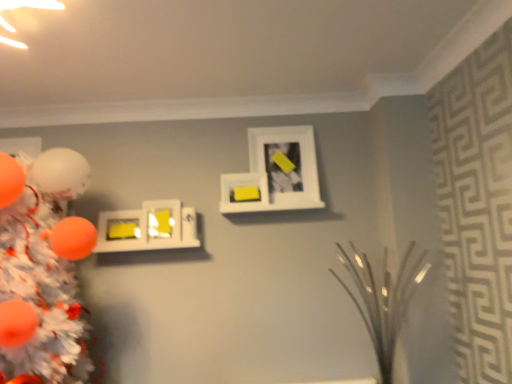
This screenshot has height=384, width=512. What do you see at coordinates (275, 173) in the screenshot?
I see `white matte picture frame at upper center, which appears as the 4th picture frame when viewed from the left` at bounding box center [275, 173].

The width and height of the screenshot is (512, 384). Find the location of `yellow matte picture frame at upper center, the 3th picture frame positioned from the left`. yellow matte picture frame at upper center, the 3th picture frame positioned from the left is located at coordinates (234, 187).

Measure the distance between yellow matte picture frame at center left, placed as the first picture frame when sorted from left to right, and camera.

yellow matte picture frame at center left, placed as the first picture frame when sorted from left to right, and camera are 7.23 feet apart.

Describe the element at coordinates (383, 299) in the screenshot. The width and height of the screenshot is (512, 384). I see `clear glass vase at center right` at that location.

The height and width of the screenshot is (384, 512). I want to click on white matte picture frame at upper center, which appears as the 4th picture frame when viewed from the left, so click(275, 173).

Can you confirm if orange matte christmas tree at left is positioned to the left of yellow matte picture frame at upper center, arranged as the second picture frame when viewed from the right?

Yes.

How different are the orientations of orange matte christmas tree at left and yellow matte picture frame at upper center, the 3th picture frame positioned from the left, in degrees?

The facing directions of orange matte christmas tree at left and yellow matte picture frame at upper center, the 3th picture frame positioned from the left, are 2.42 degrees apart.

Looking at their sizes, would you say orange matte christmas tree at left is wider or thinner than yellow matte picture frame at upper center, arranged as the second picture frame when viewed from the right?

Considering their sizes, orange matte christmas tree at left looks broader than yellow matte picture frame at upper center, arranged as the second picture frame when viewed from the right.

Is orange matte christmas tree at left facing away from yellow matte picture frame at upper center, arranged as the second picture frame when viewed from the right?

No, yellow matte picture frame at upper center, arranged as the second picture frame when viewed from the right, is not at the back of orange matte christmas tree at left.

Considering the relative positions of yellow matte picture frame at center left, which is counted as the 4th picture frame, starting from the right, and orange matte christmas tree at left in the image provided, is yellow matte picture frame at center left, which is counted as the 4th picture frame, starting from the right, behind orange matte christmas tree at left?

Yes, it is.

Is yellow matte picture frame at center left, which is counted as the 4th picture frame, starting from the right, not close to orange matte christmas tree at left?

yellow matte picture frame at center left, which is counted as the 4th picture frame, starting from the right, is actually quite close to orange matte christmas tree at left.

From the picture: Does yellow matte picture frame at center left, which is counted as the 4th picture frame, starting from the right, have a lesser height compared to orange matte christmas tree at left?

Yes.

How many degrees apart are the facing directions of clear glass vase at center right and yellow matte picture frame at upper center, the 3th picture frame positioned from the left?

clear glass vase at center right and yellow matte picture frame at upper center, the 3th picture frame positioned from the left, are facing 1.26 degrees away from each other.

Is point (402, 296) positioned after point (256, 205)?

No, it is in front of (256, 205).

Is yellow matte picture frame at upper center, arranged as the second picture frame when viewed from the right, at the back of clear glass vase at center right?

clear glass vase at center right does not have its back to yellow matte picture frame at upper center, arranged as the second picture frame when viewed from the right.

Is clear glass vase at center right touching yellow matte picture frame at upper center, arranged as the second picture frame when viewed from the right?

clear glass vase at center right is not next to yellow matte picture frame at upper center, arranged as the second picture frame when viewed from the right, and they're not touching.

Is white matte picture frame at upper center, which appears as the 4th picture frame when viewed from the left, thinner than yellow matte picture frame at center left, placed as the first picture frame when sorted from left to right?

In fact, white matte picture frame at upper center, which appears as the 4th picture frame when viewed from the left, might be wider than yellow matte picture frame at center left, placed as the first picture frame when sorted from left to right.

Is point (272, 139) positioned before point (110, 246)?

No, (272, 139) is behind (110, 246).

Does white matte picture frame at upper center, which is counted as the 1th picture frame, starting from the right, contain yellow matte picture frame at center left, placed as the first picture frame when sorted from left to right?

No, yellow matte picture frame at center left, placed as the first picture frame when sorted from left to right, is not inside white matte picture frame at upper center, which is counted as the 1th picture frame, starting from the right.

Considering the sizes of objects white matte picture frame at upper center, which is counted as the 1th picture frame, starting from the right, and yellow matte picture frame at center left, which is counted as the 4th picture frame, starting from the right, in the image provided, who is bigger, white matte picture frame at upper center, which is counted as the 1th picture frame, starting from the right, or yellow matte picture frame at center left, which is counted as the 4th picture frame, starting from the right,?

Bigger between the two is white matte picture frame at upper center, which is counted as the 1th picture frame, starting from the right.

From the image's perspective, is clear glass vase at center right positioned above or below matte yellow picture frame at center-left, arranged as the 2th picture frame when viewed from the left?

Based on their image positions, clear glass vase at center right is located beneath matte yellow picture frame at center-left, arranged as the 2th picture frame when viewed from the left.

From the picture: From a real-world perspective, does clear glass vase at center right sit lower than matte yellow picture frame at center-left, arranged as the 2th picture frame when viewed from the left?

Yes, from a real-world perspective, clear glass vase at center right is under matte yellow picture frame at center-left, arranged as the 2th picture frame when viewed from the left.

How distant is clear glass vase at center right from matte yellow picture frame at center-left, arranged as the 2th picture frame when viewed from the left?

clear glass vase at center right is 3.51 feet away from matte yellow picture frame at center-left, arranged as the 2th picture frame when viewed from the left.

Which is behind, white matte picture frame at upper center, which is counted as the 1th picture frame, starting from the right, or yellow matte picture frame at upper center, the 3th picture frame positioned from the left?

white matte picture frame at upper center, which is counted as the 1th picture frame, starting from the right, is behind.

Is white matte picture frame at upper center, which appears as the 4th picture frame when viewed from the left, positioned with its back to yellow matte picture frame at upper center, the 3th picture frame positioned from the left?

white matte picture frame at upper center, which appears as the 4th picture frame when viewed from the left, does not have its back to yellow matte picture frame at upper center, the 3th picture frame positioned from the left.

Looking at their sizes, would you say white matte picture frame at upper center, which is counted as the 1th picture frame, starting from the right, is wider or thinner than yellow matte picture frame at upper center, arranged as the second picture frame when viewed from the right?

Considering their sizes, white matte picture frame at upper center, which is counted as the 1th picture frame, starting from the right, looks broader than yellow matte picture frame at upper center, arranged as the second picture frame when viewed from the right.

From a real-world perspective, is white matte picture frame at upper center, which is counted as the 1th picture frame, starting from the right, under yellow matte picture frame at upper center, arranged as the second picture frame when viewed from the right?

No, from a real-world perspective, white matte picture frame at upper center, which is counted as the 1th picture frame, starting from the right, is not below yellow matte picture frame at upper center, arranged as the second picture frame when viewed from the right.

From the image's perspective, is matte yellow picture frame at center-left, arranged as the 2th picture frame when viewed from the left, located above or below orange matte christmas tree at left?

Clearly, from the image's perspective, matte yellow picture frame at center-left, arranged as the 2th picture frame when viewed from the left, is above orange matte christmas tree at left.

Between matte yellow picture frame at center-left, the 3th picture frame in the right-to-left sequence, and orange matte christmas tree at left, which one has smaller width?

matte yellow picture frame at center-left, the 3th picture frame in the right-to-left sequence, is thinner.

Is matte yellow picture frame at center-left, the 3th picture frame in the right-to-left sequence, facing away from orange matte christmas tree at left?

No.

Between matte yellow picture frame at center-left, the 3th picture frame in the right-to-left sequence, and orange matte christmas tree at left, which one has more height?

With more height is orange matte christmas tree at left.

Image resolution: width=512 pixels, height=384 pixels. I want to click on christmas tree beneath the yellow matte picture frame at upper center, the 3th picture frame positioned from the left (from a real-world perspective), so click(42, 268).

From the image's perspective, which picture frame is the 1st one above the orange matte christmas tree at left? Please provide its 2D coordinates.

[(121, 231)]

From the picture: From the image, which object appears to be farther from orange matte christmas tree at left, clear glass vase at center right or yellow matte picture frame at upper center, the 3th picture frame positioned from the left?

Based on the image, clear glass vase at center right appears to be further to orange matte christmas tree at left.

Which object lies nearer to the anchor point matte yellow picture frame at center-left, the 3th picture frame in the right-to-left sequence, yellow matte picture frame at upper center, the 3th picture frame positioned from the left, or yellow matte picture frame at center left, which is counted as the 4th picture frame, starting from the right?

yellow matte picture frame at center left, which is counted as the 4th picture frame, starting from the right, is positioned closer to the anchor matte yellow picture frame at center-left, the 3th picture frame in the right-to-left sequence.

Considering their positions, is yellow matte picture frame at center left, placed as the first picture frame when sorted from left to right, positioned closer to clear glass vase at center right than orange matte christmas tree at left?

The object closer to clear glass vase at center right is yellow matte picture frame at center left, placed as the first picture frame when sorted from left to right.

Looking at the image, which one is located closer to clear glass vase at center right, yellow matte picture frame at center left, which is counted as the 4th picture frame, starting from the right, or white matte picture frame at upper center, which is counted as the 1th picture frame, starting from the right?

white matte picture frame at upper center, which is counted as the 1th picture frame, starting from the right, lies closer to clear glass vase at center right than the other object.

In the scene shown: Which object lies further to the anchor point clear glass vase at center right, white matte picture frame at upper center, which is counted as the 1th picture frame, starting from the right, or matte yellow picture frame at center-left, arranged as the 2th picture frame when viewed from the left?

matte yellow picture frame at center-left, arranged as the 2th picture frame when viewed from the left, is further to clear glass vase at center right.

Considering their positions, is yellow matte picture frame at upper center, the 3th picture frame positioned from the left, positioned further to clear glass vase at center right than yellow matte picture frame at center left, placed as the first picture frame when sorted from left to right?

yellow matte picture frame at center left, placed as the first picture frame when sorted from left to right, lies further to clear glass vase at center right than the other object.

Which object lies further to the anchor point orange matte christmas tree at left, clear glass vase at center right or white matte picture frame at upper center, which is counted as the 1th picture frame, starting from the right?

clear glass vase at center right is further to orange matte christmas tree at left.

Considering their positions, is matte yellow picture frame at center-left, the 3th picture frame in the right-to-left sequence, positioned further to white matte picture frame at upper center, which appears as the 4th picture frame when viewed from the left, than clear glass vase at center right?

The object further to white matte picture frame at upper center, which appears as the 4th picture frame when viewed from the left, is clear glass vase at center right.

The height and width of the screenshot is (384, 512). I want to click on picture frame between matte yellow picture frame at center-left, arranged as the 2th picture frame when viewed from the left, and white matte picture frame at upper center, which is counted as the 1th picture frame, starting from the right, in the horizontal direction, so click(234, 187).

Locate an element on the screen. The image size is (512, 384). picture frame situated between yellow matte picture frame at center left, which is counted as the 4th picture frame, starting from the right, and yellow matte picture frame at upper center, the 3th picture frame positioned from the left, from left to right is located at coordinates click(x=163, y=219).

Locate an element on the screen. The image size is (512, 384). picture frame between orange matte christmas tree at left and yellow matte picture frame at upper center, arranged as the second picture frame when viewed from the right, in the front-back direction is located at coordinates (121, 231).